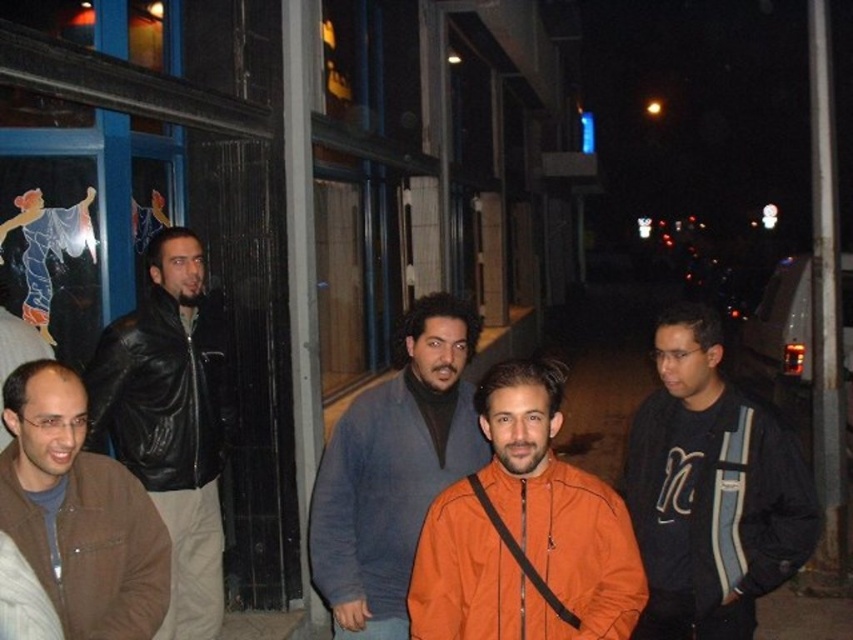
You are standing at the origin point of the coordinate system. You want to walk to the gray sweater at center. Which direction should you go?

The gray sweater at center is located at coordinate point (393, 470), so you should move towards the northeast direction to reach it.

You are standing at the point marked as point (525, 531) in the image. Looking around, you see the orange matte jacket at center. Which direction should you walk to face the building with large windows?

Since point (525, 531) corresponds to the orange matte jacket at center, you are already facing the building with large windows. Therefore, you don not need to change your direction.